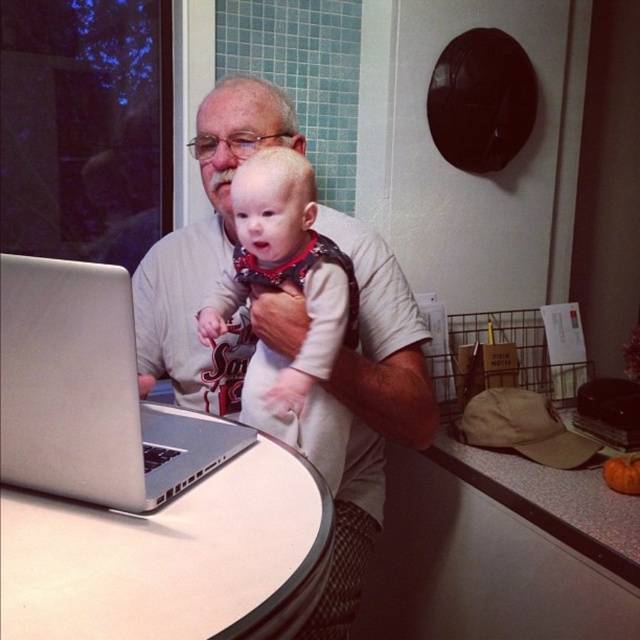
In the scene shown: Between white laminate table at center and matte white shirt at center, which one appears on the right side from the viewer's perspective?

matte white shirt at center is more to the right.

Locate an element on the screen. white laminate table at center is located at coordinates (173, 548).

Which is in front, point (3, 506) or point (362, 563)?

Positioned in front is point (3, 506).

This screenshot has width=640, height=640. Find the location of `white laminate table at center`. white laminate table at center is located at coordinates (173, 548).

Who is positioned more to the right, matte white shirt at center or silver metallic laptop at left?

matte white shirt at center

Who is taller, matte white shirt at center or silver metallic laptop at left?

matte white shirt at center

You are a GUI agent. You are given a task and a screenshot of the screen. Output one action in this format:
    pyautogui.click(x=<x>, y=<y>)
    Task: Click on the matte white shirt at center
    The width and height of the screenshot is (640, 640).
    Given the screenshot: What is the action you would take?
    pyautogui.click(x=214, y=260)

Does matte white baby at center have a lesser height compared to speckled laminate counter top at lower right?

Incorrect, matte white baby at center's height does not fall short of speckled laminate counter top at lower right's.

Does point (259, 273) come in front of point (611, 541)?

That is True.

Between point (280, 232) and point (614, 538), which one is positioned in front?

Positioned in front is point (280, 232).

Where is `matte white baby at center`? matte white baby at center is located at coordinates (305, 304).